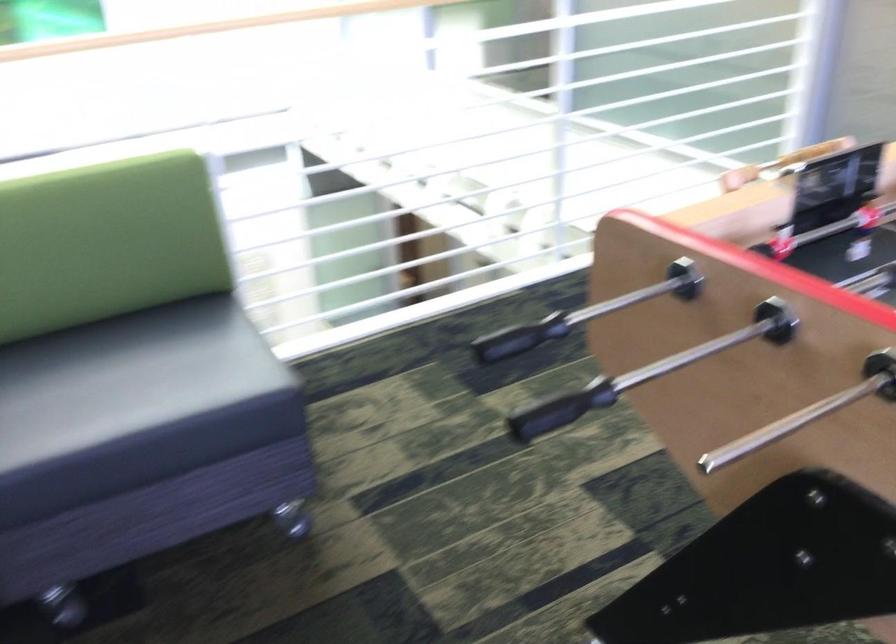
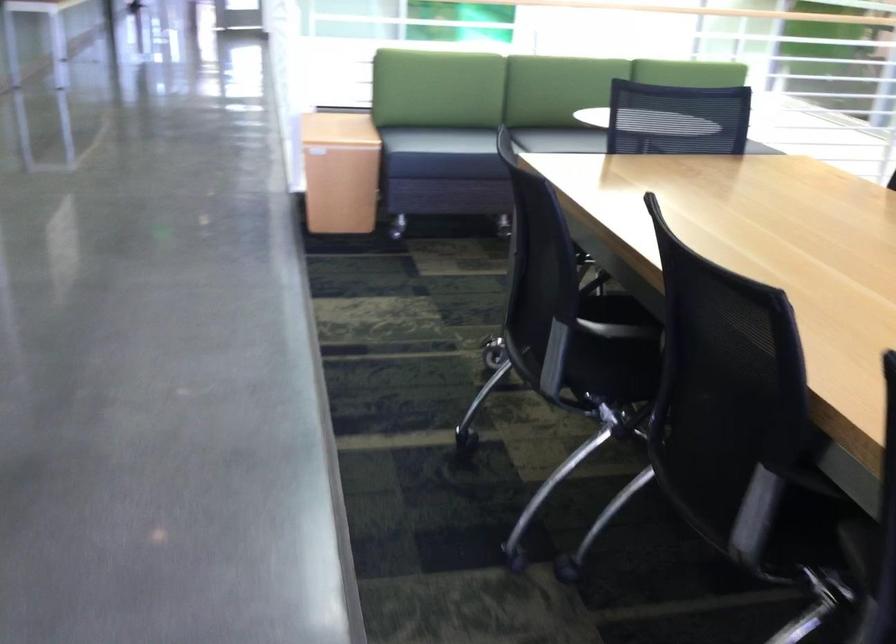
In a continuous first-person perspective shot, in which direction is the camera moving?

The cameraman moved toward left, backward.